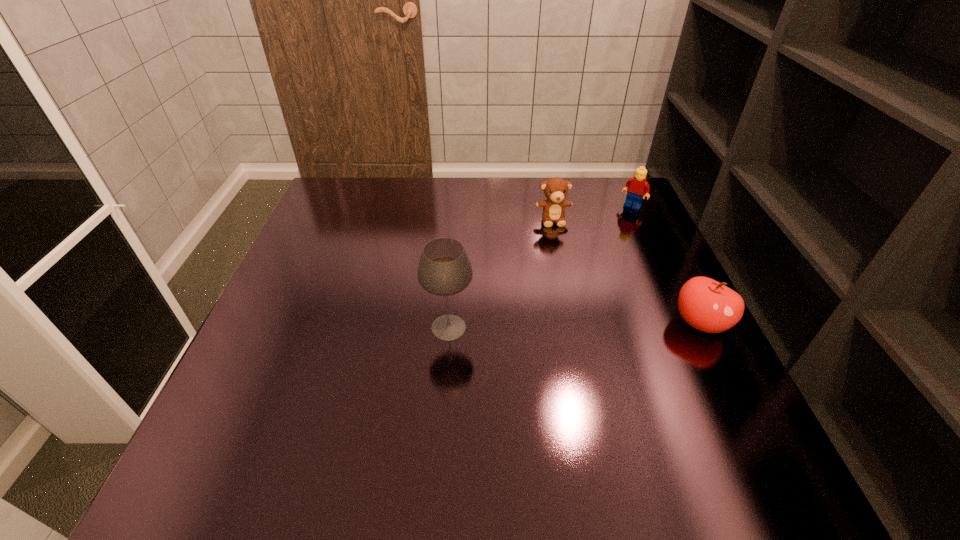
Where is `the leftmost object`? the leftmost object is located at coordinates (444, 269).

Locate an element on the screen. This screenshot has height=540, width=960. wineglass is located at coordinates (444, 269).

Locate an element on the screen. This screenshot has width=960, height=540. apple is located at coordinates (706, 304).

What are the coordinates of `the second farthest object` in the screenshot? It's located at (555, 189).

Locate an element on the screen. The image size is (960, 540). the third object from right to left is located at coordinates (x=555, y=189).

You are a GUI agent. You are given a task and a screenshot of the screen. Output one action in this format:
    pyautogui.click(x=<x>, y=<y>)
    Task: Click on the farthest object
    The width and height of the screenshot is (960, 540).
    Given the screenshot: What is the action you would take?
    pyautogui.click(x=636, y=187)

Locate an element on the screen. The image size is (960, 540). blank space located 0.130m on the back of the tallest object is located at coordinates (453, 270).

This screenshot has width=960, height=540. In order to click on vacant position located on the left of the apple in this screenshot , I will do `click(559, 323)`.

You are a GUI agent. You are given a task and a screenshot of the screen. Output one action in this format:
    pyautogui.click(x=<x>, y=<y>)
    Task: Click on the vacant region located on the face of the teddy bear
    The width and height of the screenshot is (960, 540).
    Given the screenshot: What is the action you would take?
    pyautogui.click(x=565, y=267)

I want to click on free space located 0.200m on the face of the teddy bear, so click(x=568, y=278).